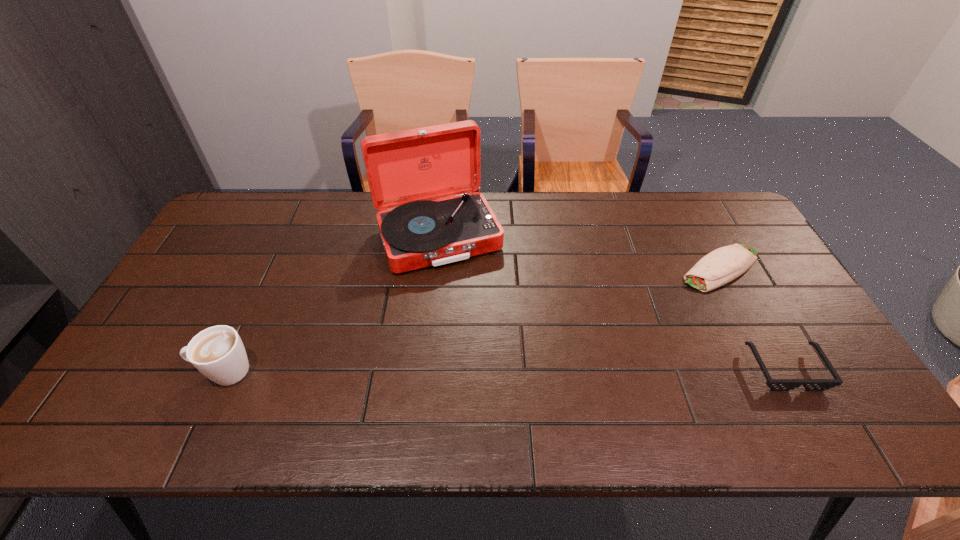
You are a GUI agent. You are given a task and a screenshot of the screen. Output one action in this format:
    pyautogui.click(x=<x>, y=<y>)
    Task: Click on the third shortest object
    
    Given the screenshot: What is the action you would take?
    pyautogui.click(x=217, y=352)

Locate an element on the screen. cappuccino is located at coordinates (217, 352).

In order to click on sunglasses in this screenshot , I will do `click(774, 384)`.

Identify the location of burrito. (719, 267).

Locate an element on the screen. Image resolution: width=960 pixels, height=540 pixels. the third object from right to left is located at coordinates (406, 169).

The image size is (960, 540). Find the location of `phonograph_record`. phonograph_record is located at coordinates (406, 169).

Find the location of `vacant space located with the handle on the side of the leftmost object`. vacant space located with the handle on the side of the leftmost object is located at coordinates click(x=175, y=371).

Locate an element on the screen. The height and width of the screenshot is (540, 960). free space located 0.120m at the bitten end of the burrito is located at coordinates (663, 299).

Image resolution: width=960 pixels, height=540 pixels. I want to click on vacant position located at the bitten end of the burrito, so click(634, 318).

Find the location of `vacant area situated at the bitten end of the burrito`. vacant area situated at the bitten end of the burrito is located at coordinates (629, 321).